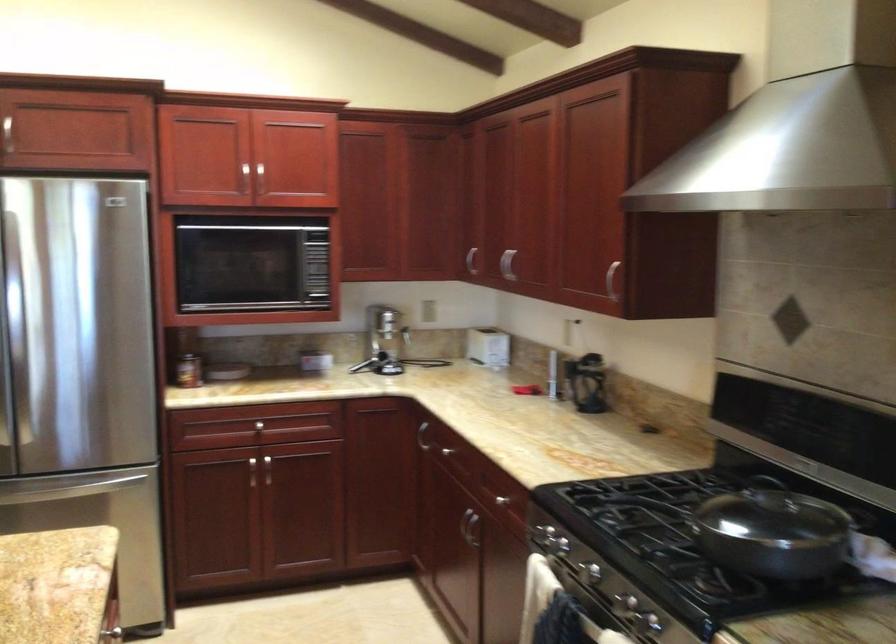
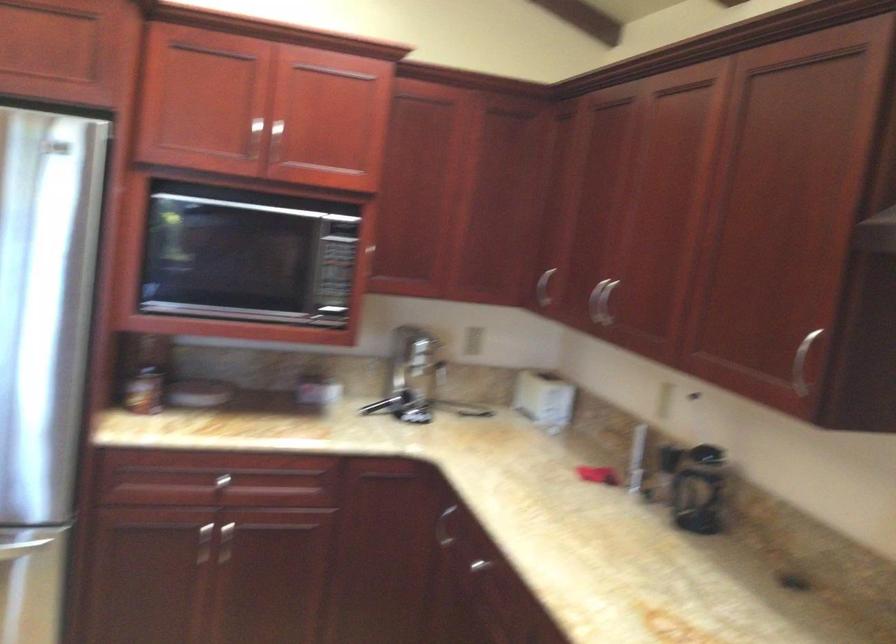
The point at (248, 476) is marked in the first image. Where is the corresponding point in the second image?

(203, 544)